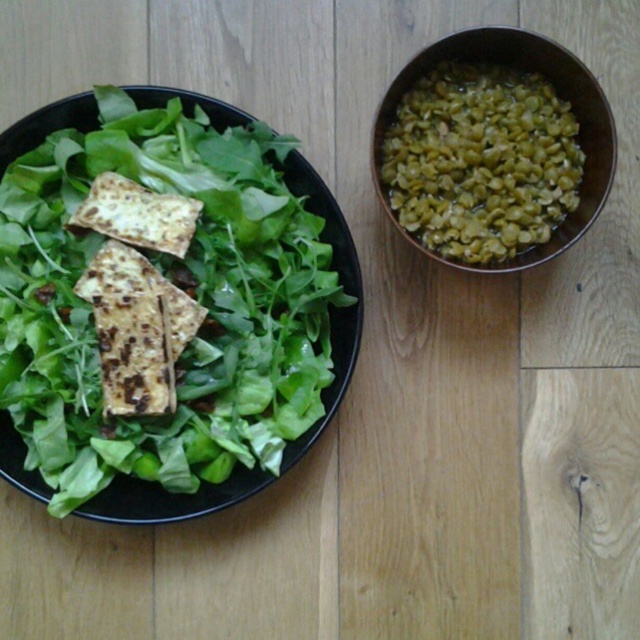
You are a food critic analyzing the layout of this meal. The wooden surface has a black plate with leafy greens and tofu on the left and a dark brown bowl of lentils on the right. There is a specific point at coordinates (x=330, y=308). What type of food item is located at this point?

The point at coordinates (x=330, y=308) corresponds to the green leafy material or vegetable at left, which is part of the black plate containing leafy greens and tofu.

You are looking at the wooden surface with the meal. There are two points marked on the image, point 1 at coordinates point [340,257] and point 2 at coordinates point [400,83]. Which point is closer to you?

Point [340,257] is closer to you than point [400,83] because it is further to the viewer.